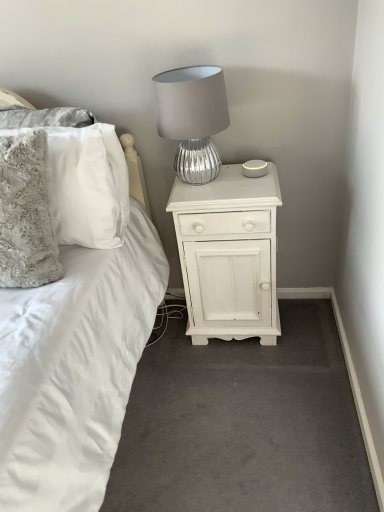
The height and width of the screenshot is (512, 384). Identify the location of vacant area located to the right-hand side of white painted wood nightstand at center. (304, 328).